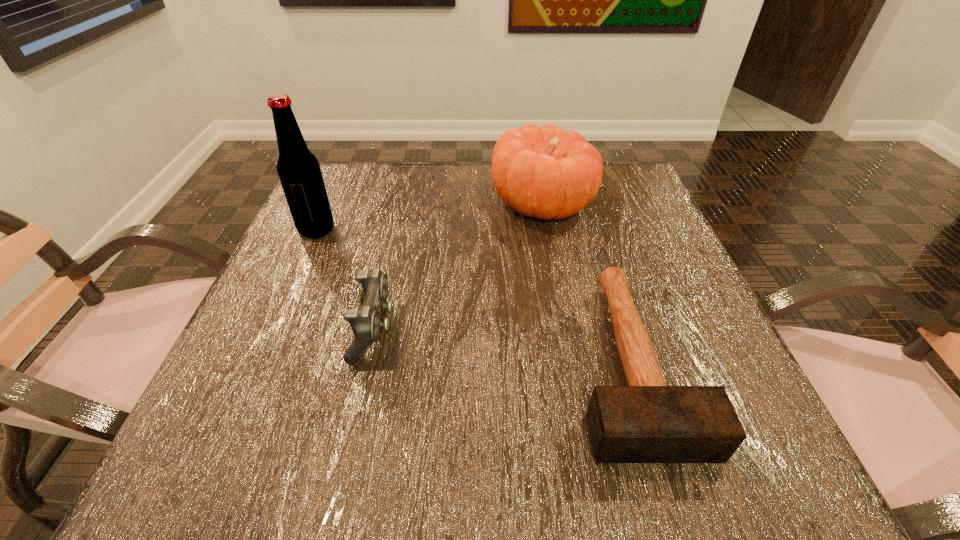
This screenshot has height=540, width=960. Find the location of `object at the near edge`. object at the near edge is located at coordinates (647, 421).

At what (x,y) coordinates should I click in order to perform the action: click on object located in the left edge section of the desktop. Please return your answer as a coordinate pair (x, y). This screenshot has height=540, width=960. Looking at the image, I should click on (298, 169).

I want to click on pumpkin that is at the right edge, so click(x=546, y=173).

This screenshot has height=540, width=960. Find the location of `mallet positioned at the right edge`. mallet positioned at the right edge is located at coordinates (647, 421).

Where is `object that is positioned at the far right corner`? This screenshot has height=540, width=960. object that is positioned at the far right corner is located at coordinates (546, 173).

Identify the location of object that is at the near right corner. The width and height of the screenshot is (960, 540). (647, 421).

Locate an element on the screen. The width and height of the screenshot is (960, 540). vacant point at the far edge is located at coordinates (571, 217).

Find the location of a particular element. This screenshot has height=540, width=960. vacant area at the near edge of the desktop is located at coordinates (568, 426).

The image size is (960, 540). Identify the location of free space at the left edge of the desktop. (342, 283).

At what (x,y) coordinates should I click in order to perform the action: click on blank space at the right edge. Please return your answer as a coordinate pair (x, y). Looking at the image, I should click on (675, 288).